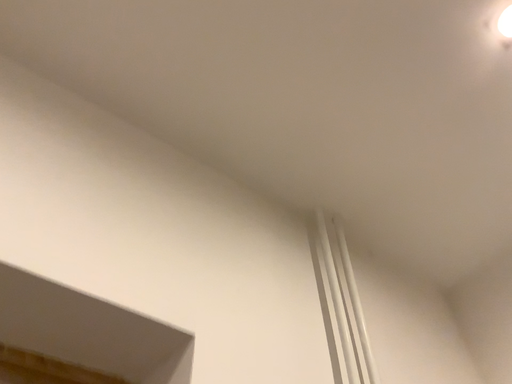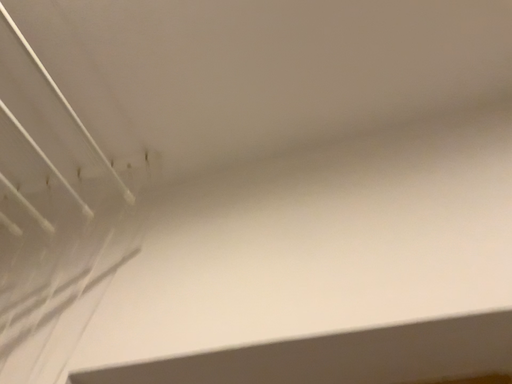
Question: How did the camera likely rotate when shooting the video?

Choices:
 (A) rotated right
 (B) rotated left

Answer: (B)